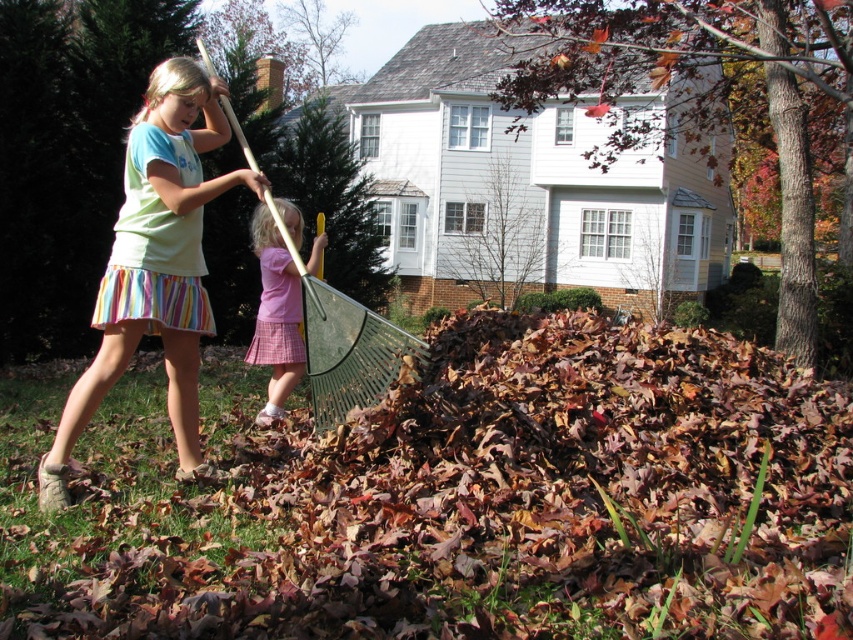
Question: Among these points, which one is nearest to the camera?

Choices:
 (A) (177, 186)
 (B) (505, 465)

Answer: (B)

Question: Among these objects, which one is nearest to the camera?

Choices:
 (A) brown dry leaves at center
 (B) light green cotton shirt at center

Answer: (A)

Question: Which point is farther from the camera taking this photo?

Choices:
 (A) (625, 419)
 (B) (253, 339)
 (C) (154, 292)

Answer: (B)

Question: Where is light green cotton shirt at center located in relation to green plastic shovel at center in the image?

Choices:
 (A) above
 (B) below

Answer: (B)

Question: In this image, where is brown dry leaves at center located relative to green plastic shovel at center?

Choices:
 (A) below
 (B) above

Answer: (A)

Question: Where is brown dry leaves at center located in relation to green plastic shovel at center in the image?

Choices:
 (A) below
 (B) above

Answer: (A)